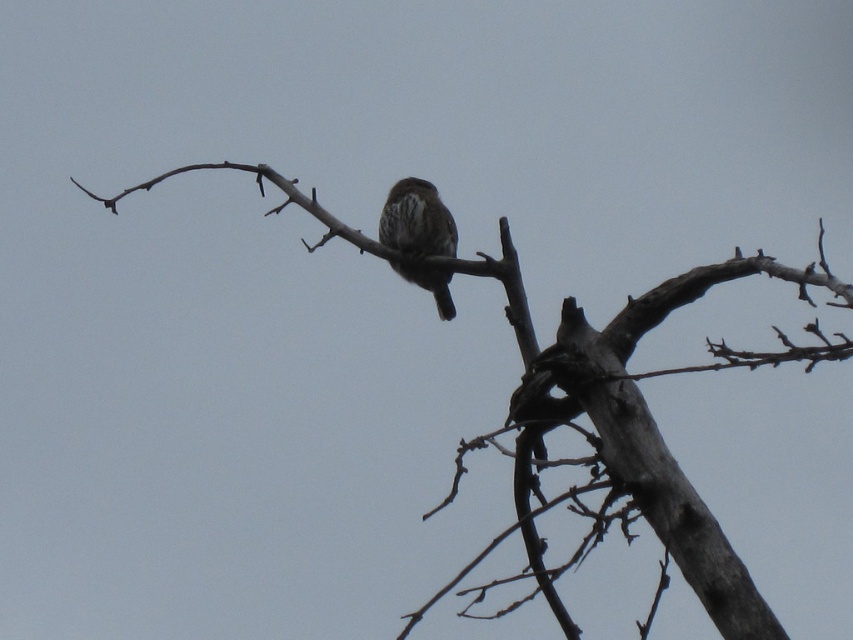
Who is positioned more to the right, brown textured branch at center or brown speckled bird at center?

Positioned to the right is brown textured branch at center.

Does brown textured branch at center have a smaller size compared to brown speckled bird at center?

Actually, brown textured branch at center might be larger than brown speckled bird at center.

This screenshot has width=853, height=640. I want to click on brown textured branch at center, so click(x=596, y=413).